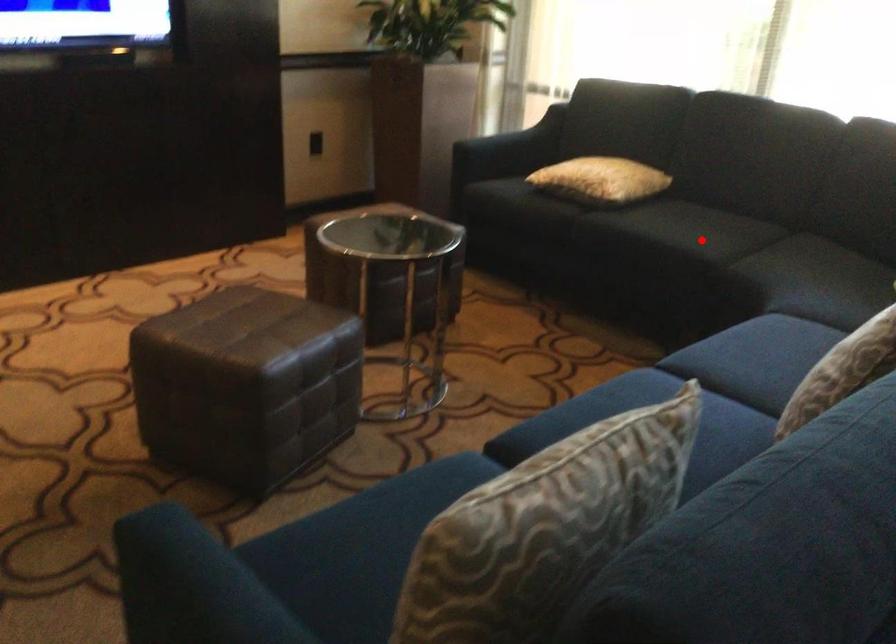
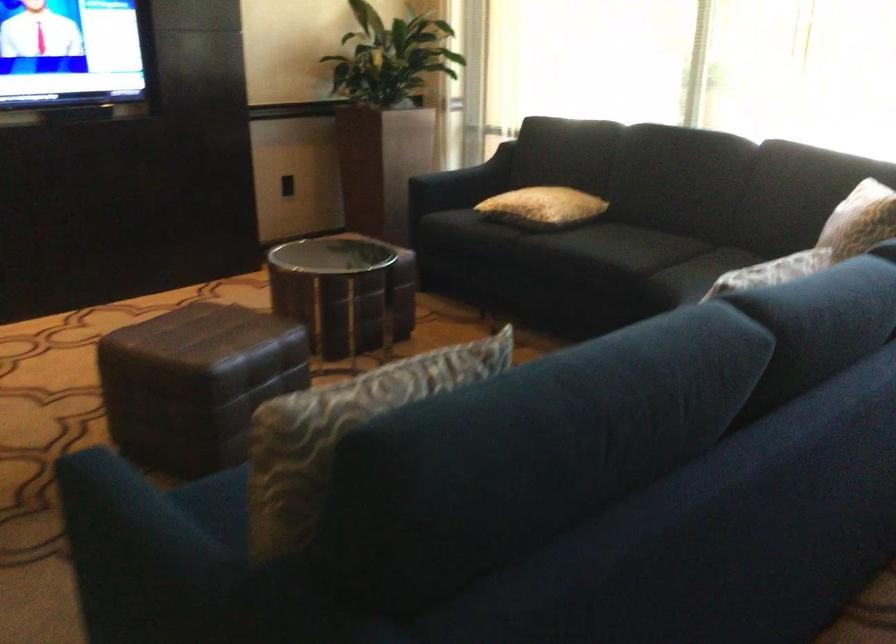
The point at the highlighted location is marked in the first image. Where is the corresponding point in the second image?

(626, 254)